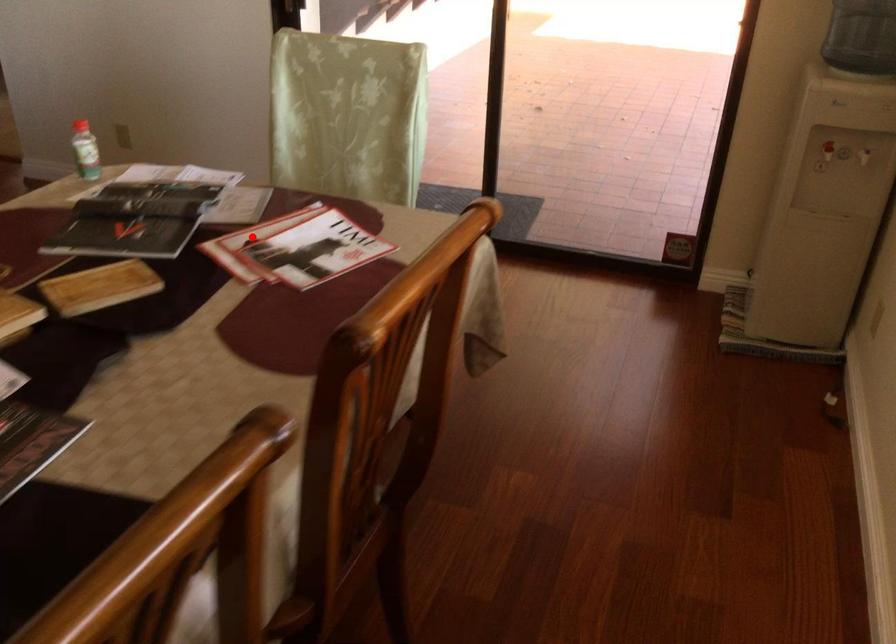
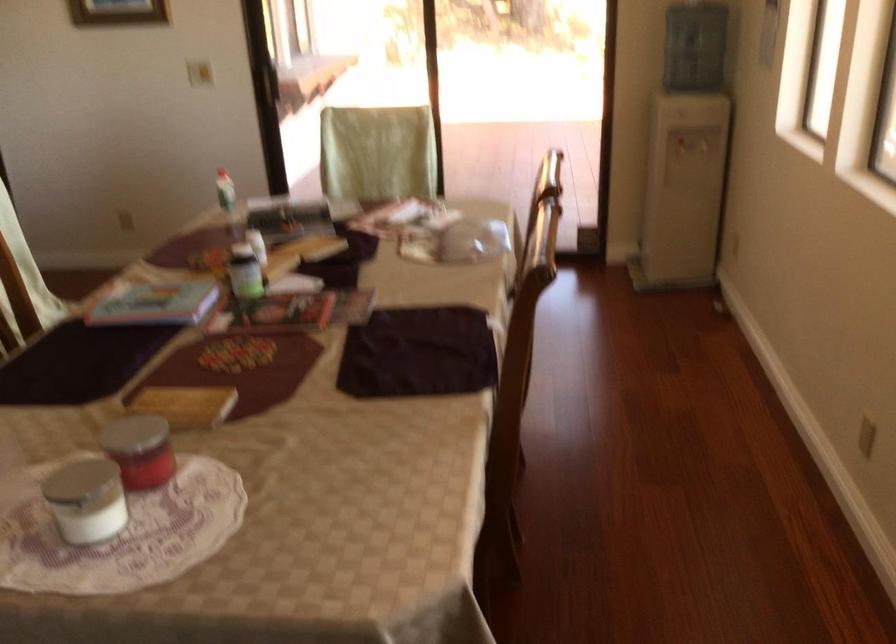
Question: A red point is marked in image1. In image2, is the corresponding 3D point closer to the camera or farther? Reply with the corresponding letter.

Choices:
 (A) The corresponding 3D point is closer.
 (B) The corresponding 3D point is farther.

Answer: (B)